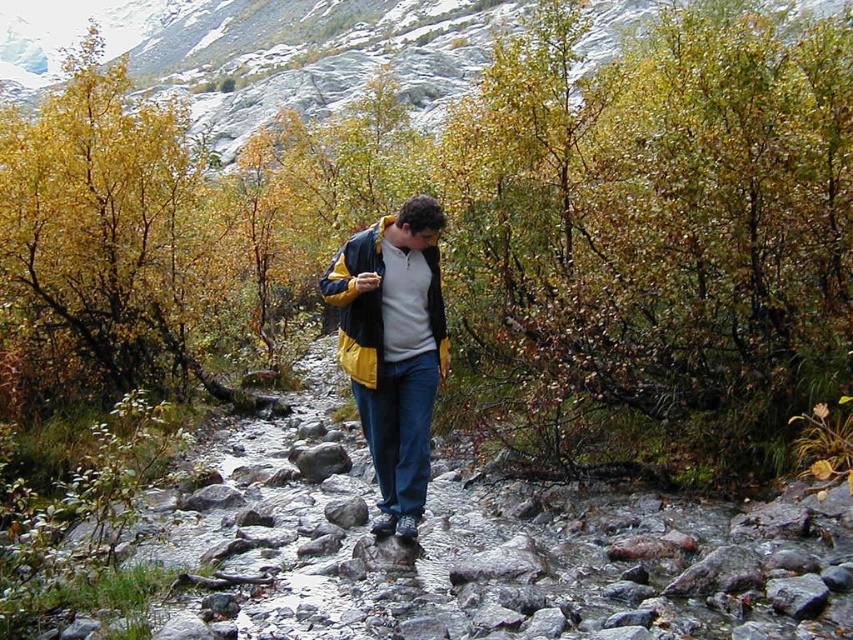
Question: Is rocky gray mountain at upper center to the right of yellow matte jacket at center from the viewer's perspective?

Choices:
 (A) yes
 (B) no

Answer: (B)

Question: Which object appears closest to the camera in this image?

Choices:
 (A) rocky gray mountain at upper center
 (B) yellow matte jacket at center

Answer: (B)

Question: Which point is closer to the camera taking this photo?

Choices:
 (A) (293, 74)
 (B) (408, 340)

Answer: (B)

Question: Is rocky gray mountain at upper center thinner than yellow matte jacket at center?

Choices:
 (A) no
 (B) yes

Answer: (A)

Question: Is rocky gray mountain at upper center to the right of yellow matte jacket at center from the viewer's perspective?

Choices:
 (A) no
 (B) yes

Answer: (A)